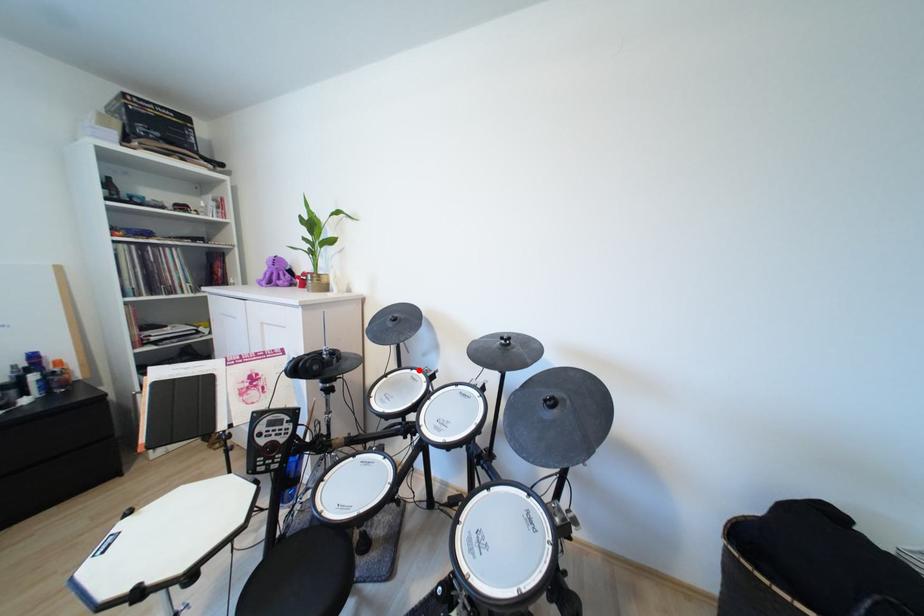
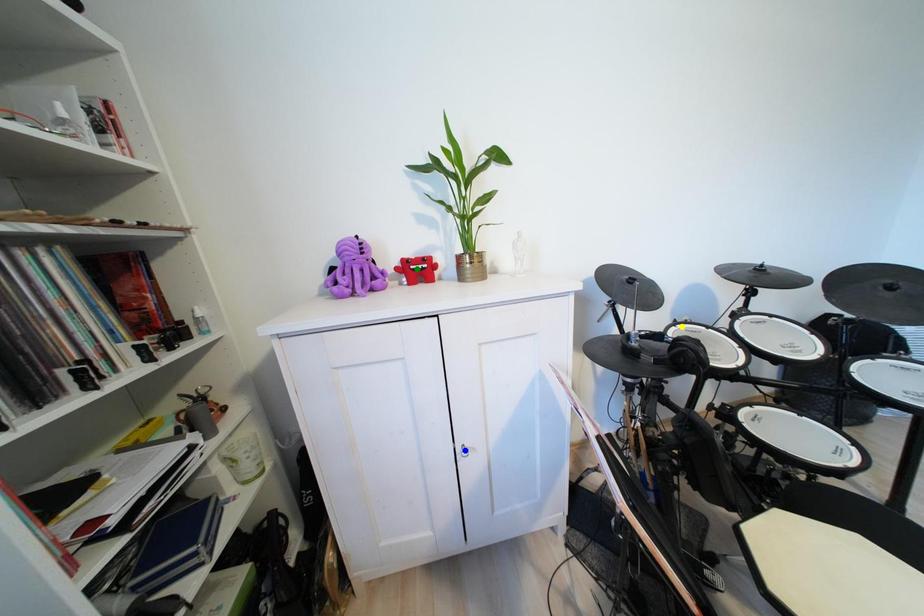
Question: I am providing you with two images of the same scene from different viewpoints. A red point is marked on the first image. You are given multiple points on the second image. Which point in image 2 is actually the same real-world point as the red point in image 1?

Choices:
 (A) yellow point
 (B) green point
 (C) blue point

Answer: (A)